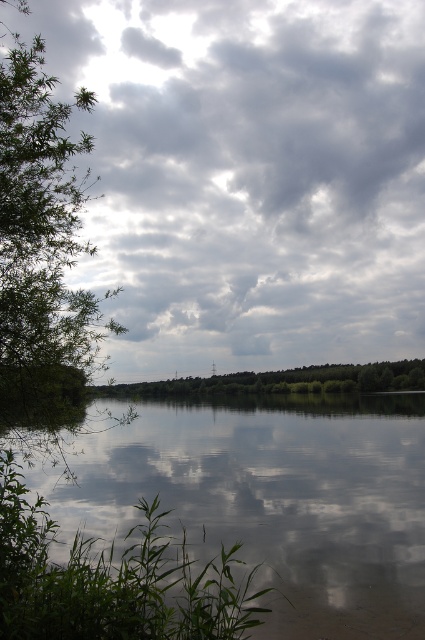
Is smooth reflective water at center below green leafy trees at center?

Yes.

Consider the image. Between smooth reflective water at center and green leafy trees at center, which one appears on the left side from the viewer's perspective?

smooth reflective water at center

Describe the element at coordinates (221, 531) in the screenshot. I see `smooth reflective water at center` at that location.

At what (x,y) coordinates should I click in order to perform the action: click on smooth reflective water at center. Please return your answer as a coordinate pair (x, y). Looking at the image, I should click on (221, 531).

Based on the photo, who is lower down, green leafy tree at left or green leafy trees at center?

green leafy trees at center is below.

Does point (82, 296) come in front of point (277, 371)?

Yes.

Identify the location of green leafy tree at left. (42, 243).

Based on the photo, between cloudy sky at upper center and green leafy trees at center, which one has less height?

green leafy trees at center

Measure the distance between point (x=164, y=112) and camera.

Point (x=164, y=112) and camera are 21.39 meters apart from each other.

Locate an element on the screen. The height and width of the screenshot is (640, 425). cloudy sky at upper center is located at coordinates coord(248,177).